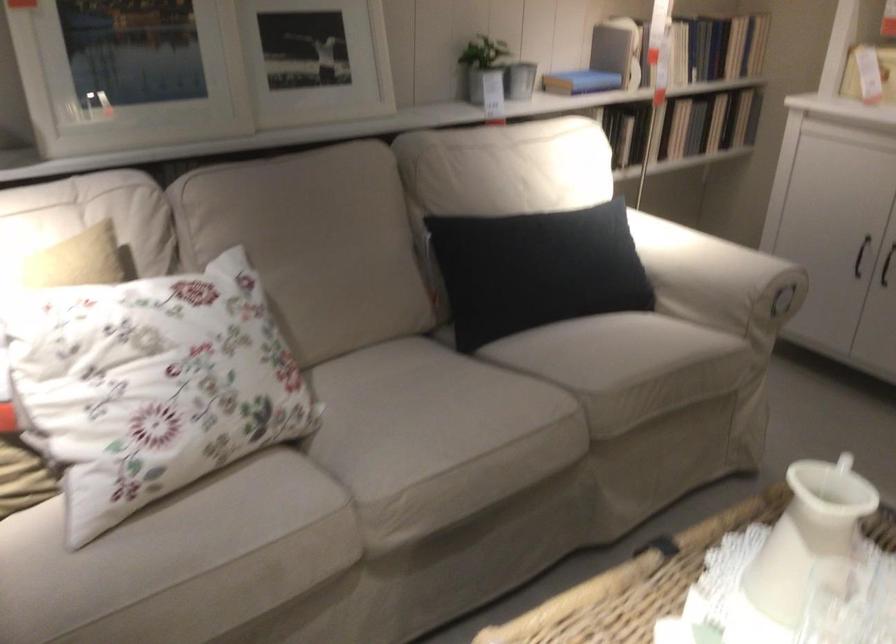
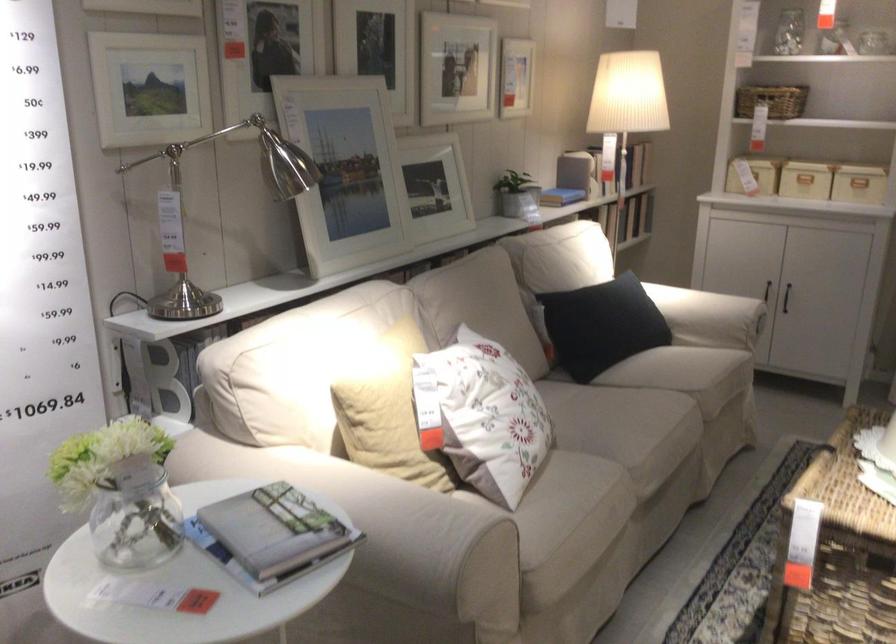
Find the pixel in the second image that matches pixel 686 289 in the first image.

(709, 317)